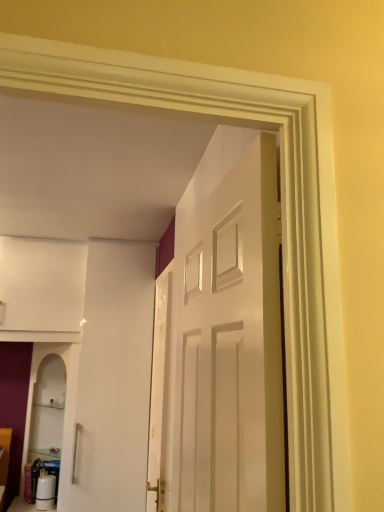
Question: Is white glossy door at center wider or thinner than white glossy door at center?

Choices:
 (A) wide
 (B) thin

Answer: (A)

Question: Is white glossy door at center inside the boundaries of white glossy door at center, or outside?

Choices:
 (A) inside
 (B) outside

Answer: (B)

Question: From a real-world perspective, relative to white glossy door at center, is white glossy door at center vertically above or below?

Choices:
 (A) above
 (B) below

Answer: (A)

Question: From the image's perspective, is white glossy door at center positioned above or below white glossy door at center?

Choices:
 (A) above
 (B) below

Answer: (B)

Question: Considering the positions of point (160, 490) and point (178, 381), is point (160, 490) closer or farther from the camera than point (178, 381)?

Choices:
 (A) farther
 (B) closer

Answer: (A)

Question: Looking at their shapes, would you say white glossy door at center is wider or thinner than white glossy door at center?

Choices:
 (A) thin
 (B) wide

Answer: (A)

Question: From a real-world perspective, is white glossy door at center above or below white glossy door at center?

Choices:
 (A) above
 (B) below

Answer: (B)